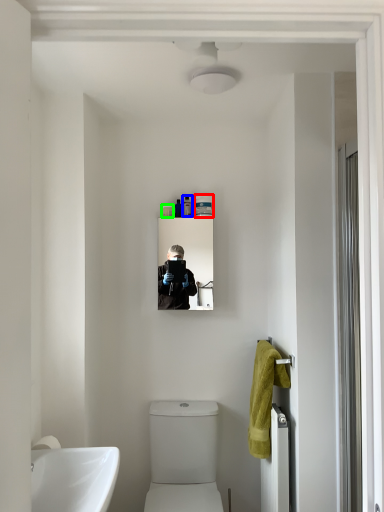
Question: Which object is the farthest from toiletry (highlighted by a red box)? Choose among these: toiletry (highlighted by a blue box) or toiletry (highlighted by a green box).

Choices:
 (A) toiletry
 (B) toiletry

Answer: (B)